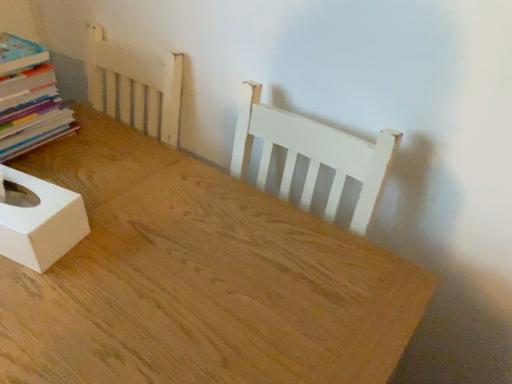
The width and height of the screenshot is (512, 384). Identify the location of free point in front of white matte tissue box at lower left. (33, 310).